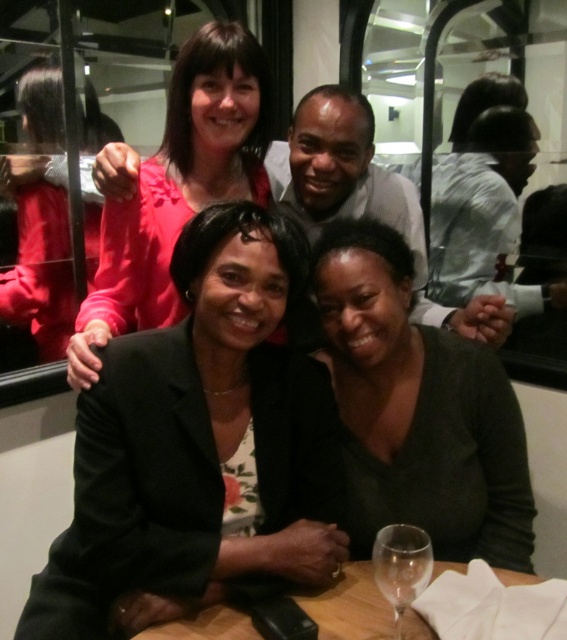
You are a server at the restaurant and need to place a new dessert menu on the table. The menu is as wide as the transparent glass at lower center. Will it fit entirely on the wooden table at lower center?

The wooden table at lower center is wider than the transparent glass at lower center, so the dessert menu will fit entirely on the wooden table at lower center since its width matches the glass and the table is wider.

You are a photographer trying to capture a group photo of the white shirt at upper center and the matte pink sweater at upper left. Based on their heights, which one should you position closer to the camera to ensure both are in focus?

Since the white shirt at upper center is shorter than the matte pink sweater at upper left, you should position the white shirt at upper center closer to the camera to ensure both are in focus.

You are a server at a restaurant and need to place a 15 inch dessert plate between the black matte blazer at center and the transparent glass at lower center. Can you fit it there?

The distance between the black matte blazer at center and the transparent glass at lower center is 14.85 inches. Since the dessert plate is 15 inches wide, it won not fit in the available space.